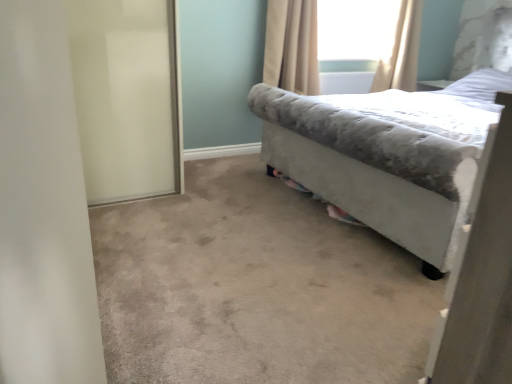
Question: Is transparent glass window screen at upper center at the back of white frosted glass screen door at left?

Choices:
 (A) yes
 (B) no

Answer: (B)

Question: Is white frosted glass screen door at left smaller than transparent glass window screen at upper center?

Choices:
 (A) no
 (B) yes

Answer: (A)

Question: Does white frosted glass screen door at left have a greater height compared to transparent glass window screen at upper center?

Choices:
 (A) no
 (B) yes

Answer: (B)

Question: From the image's perspective, is white frosted glass screen door at left below transparent glass window screen at upper center?

Choices:
 (A) no
 (B) yes

Answer: (B)

Question: Can you confirm if white frosted glass screen door at left is bigger than transparent glass window screen at upper center?

Choices:
 (A) yes
 (B) no

Answer: (A)

Question: Visually, is velvet gray bed at right positioned to the left or to the right of beige fabric curtain at upper center, the 2th curtain in the right-to-left sequence?

Choices:
 (A) right
 (B) left

Answer: (A)

Question: From the image's perspective, is velvet gray bed at right positioned above or below beige fabric curtain at upper center, marked as the first curtain in a left-to-right arrangement?

Choices:
 (A) below
 (B) above

Answer: (A)

Question: From their relative heights in the image, would you say velvet gray bed at right is taller or shorter than beige fabric curtain at upper center, marked as the first curtain in a left-to-right arrangement?

Choices:
 (A) short
 (B) tall

Answer: (B)

Question: Is velvet gray bed at right wider or thinner than beige fabric curtain at upper center, marked as the first curtain in a left-to-right arrangement?

Choices:
 (A) thin
 (B) wide

Answer: (B)

Question: Is beige fabric curtain at upper right, the second curtain positioned from the left, inside the boundaries of beige fabric curtain at upper center, the 2th curtain in the right-to-left sequence, or outside?

Choices:
 (A) outside
 (B) inside

Answer: (A)

Question: From a real-world perspective, relative to beige fabric curtain at upper center, the 2th curtain in the right-to-left sequence, is beige fabric curtain at upper right, the second curtain positioned from the left, vertically above or below?

Choices:
 (A) below
 (B) above

Answer: (B)

Question: From the image's perspective, is beige fabric curtain at upper right, which is counted as the first curtain, starting from the right, above or below beige fabric curtain at upper center, marked as the first curtain in a left-to-right arrangement?

Choices:
 (A) above
 (B) below

Answer: (A)

Question: Is beige fabric curtain at upper right, the second curtain positioned from the left, to the left or to the right of beige fabric curtain at upper center, the 2th curtain in the right-to-left sequence, in the image?

Choices:
 (A) left
 (B) right

Answer: (B)

Question: From the image's perspective, is transparent glass window screen at upper center located above or below beige fabric curtain at upper center, marked as the first curtain in a left-to-right arrangement?

Choices:
 (A) below
 (B) above

Answer: (B)

Question: Relative to beige fabric curtain at upper center, the 2th curtain in the right-to-left sequence, is transparent glass window screen at upper center in front or behind?

Choices:
 (A) behind
 (B) front

Answer: (A)